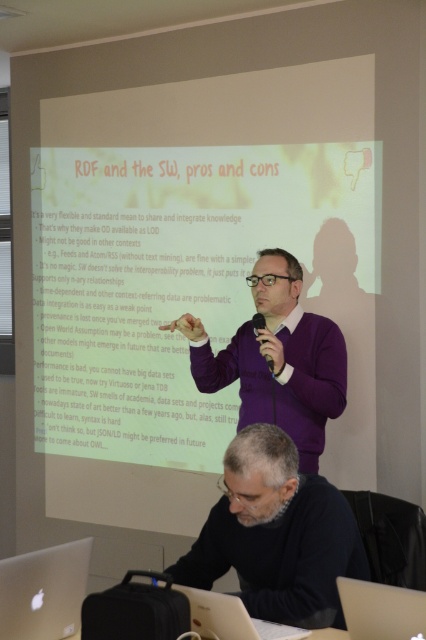
You are organizing a tech conference and need to set up a presentation area. You have a silver metallic laptop at lower right and a matte white table at lower center. Which object is wider?

The silver metallic laptop at lower right is wider than the matte white table at lower center according to the description.

You are a photographer standing in the front of the presentation room. You want to take a photo of the silver metallic laptop at lower center without the gray sweater at lower center blocking it. Can you move to the left or right to achieve this?

The gray sweater at lower center is further to the viewer than silver metallic laptop at lower center. To avoid the gray sweater at lower center blocking the silver metallic laptop at lower center, you should move to either the left or right side to position yourself so that the gray sweater is no longer in front of the laptop. However, since both objects are at lower center, moving sideways might not be sufficient. Alternatively, moving forward or backward could adjust the perspective, but the description

You are organizing a tech conference and need to set up a presentation area. You have a silver metallic laptop at lower right and a matte white table at lower center. Which object is taller?

The silver metallic laptop at lower right is taller than the matte white table at lower center.